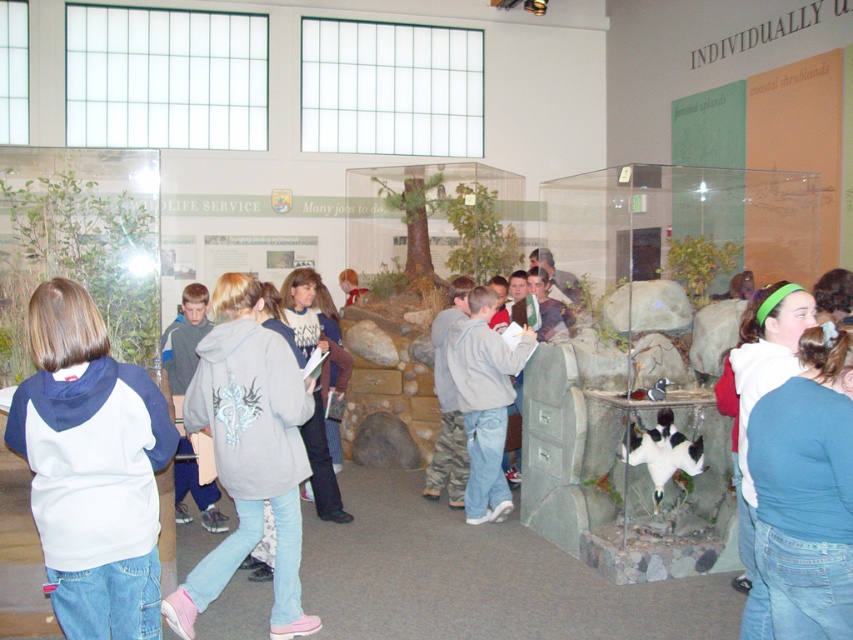
Question: Can you confirm if white fleece sweatshirt at center is positioned above light gray hoodie at center?

Choices:
 (A) yes
 (B) no

Answer: (A)

Question: Is light gray hoodie at center bigger than gray matte hoodie at center?

Choices:
 (A) no
 (B) yes

Answer: (B)

Question: Considering the real-world distances, which object is closest to the white fleece sweatshirt at center?

Choices:
 (A) gray matte hoodie at center
 (B) light gray hoodie at center

Answer: (B)

Question: Which of the following is the closest to the observer?

Choices:
 (A) light gray hoodie at center
 (B) gray matte hoodie at center
 (C) white fleece sweatshirt at center

Answer: (C)

Question: Can you confirm if white fleece sweatshirt at center is thinner than light gray hoodie at center?

Choices:
 (A) yes
 (B) no

Answer: (A)

Question: Estimate the real-world distances between objects in this image. Which object is closer to the gray matte hoodie at center?

Choices:
 (A) light gray hoodie at center
 (B) white fleece sweatshirt at center

Answer: (A)